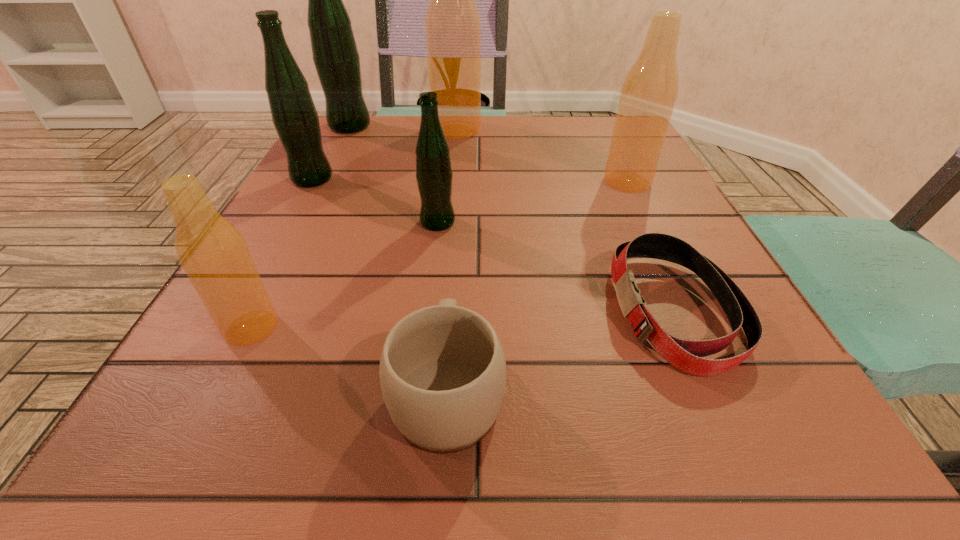
What are the coordinates of `vacant area between the mug and the second farthest tan beer bottle` in the screenshot? It's located at (538, 286).

Image resolution: width=960 pixels, height=540 pixels. In order to click on free area in between the farthest green beer bottle and the mug in this screenshot , I will do `click(398, 258)`.

Where is `free space that is in between the second farthest tan beer bottle and the farthest green beer bottle`? free space that is in between the second farthest tan beer bottle and the farthest green beer bottle is located at coordinates (489, 154).

Identify which object is located as the sixth nearest to the biggest green beer bottle. Please provide its 2D coordinates. Your answer should be formatted as a tuple, i.e. [(x, y)], where the tuple contains the x and y coordinates of a point satisfying the conditions above.

[(442, 371)]

Locate an element on the screen. This screenshot has width=960, height=540. the fifth closest object to the second smallest green beer bottle is located at coordinates (442, 371).

Where is `beer bottle object that ranks as the fifth closest to the biggest tan beer bottle`? This screenshot has width=960, height=540. beer bottle object that ranks as the fifth closest to the biggest tan beer bottle is located at coordinates (213, 253).

Identify which beer bottle is located as the fifth nearest to the farthest green beer bottle. Please provide its 2D coordinates. Your answer should be formatted as a tuple, i.e. [(x, y)], where the tuple contains the x and y coordinates of a point satisfying the conditions above.

[(213, 253)]

In order to click on the closest green beer bottle relative to the second farthest green beer bottle in this screenshot , I will do `click(335, 55)`.

You are a GUI agent. You are given a task and a screenshot of the screen. Output one action in this format:
    pyautogui.click(x=<x>, y=<y>)
    Task: Click on the green beer bottle object that ranks as the second closest to the dog collar
    
    Given the screenshot: What is the action you would take?
    pyautogui.click(x=294, y=115)

Identify which tan beer bottle is located as the nearest to the rightmost green beer bottle. Please provide its 2D coordinates. Your answer should be formatted as a tuple, i.e. [(x, y)], where the tuple contains the x and y coordinates of a point satisfying the conditions above.

[(213, 253)]